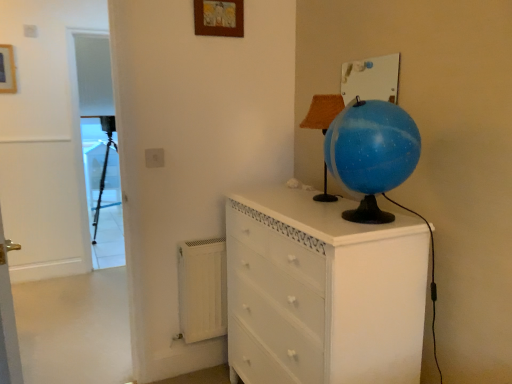
Question: Considering the positions of matte black tripod at left and wooden picture frame at upper center, the second picture frame from the left, in the image, is matte black tripod at left taller or shorter than wooden picture frame at upper center, the second picture frame from the left,?

Choices:
 (A) short
 (B) tall

Answer: (B)

Question: Considering the relative positions of matte black tripod at left and wooden picture frame at upper center, the 2th picture frame positioned from the back, in the image provided, is matte black tripod at left to the left or to the right of wooden picture frame at upper center, the 2th picture frame positioned from the back,?

Choices:
 (A) left
 (B) right

Answer: (A)

Question: Which of these objects is positioned farthest from the white painted wood chest of drawers at center?

Choices:
 (A) transparent plastic screen door at left
 (B) white matte radiator at lower left
 (C) white plastic electric outlet at upper center
 (D) matte black tripod at left
 (E) wooden picture frame at upper left, which is counted as the first picture frame, starting from the left

Answer: (D)

Question: Which object is the farthest from the white wooden door at center?

Choices:
 (A) blue glossy globe at upper right
 (B) matte black tripod at left
 (C) burlap-textured lampshade at upper center
 (D) white plastic electric outlet at upper center
 (E) white painted wood chest of drawers at center

Answer: (A)